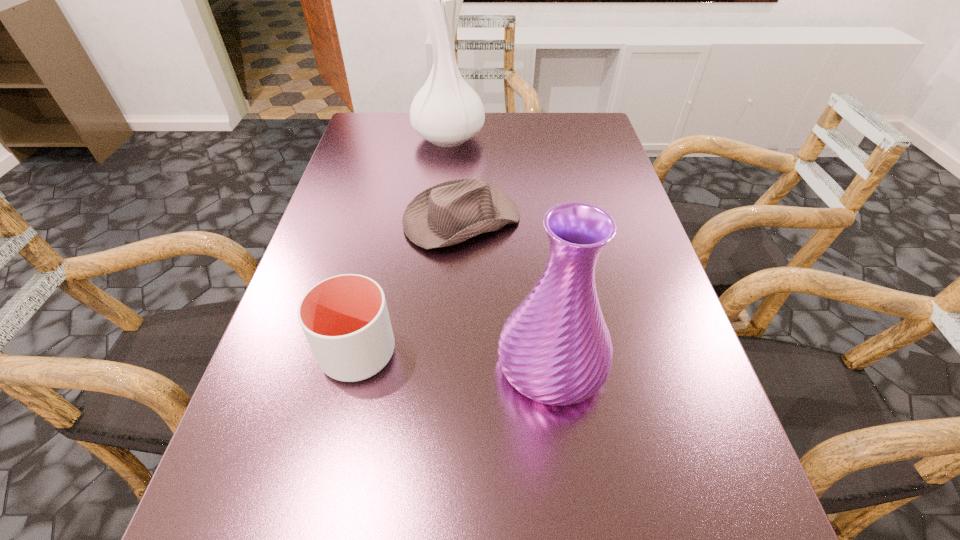
The image size is (960, 540). Identify the location of free spot between the second shortest object and the farther vase. (403, 245).

This screenshot has width=960, height=540. What are the coordinates of `unoccupied area between the third nearest object and the farthest object` in the screenshot? It's located at (455, 179).

The height and width of the screenshot is (540, 960). I want to click on free space between the farther vase and the second farthest object, so click(455, 179).

Find the location of a particular element. empty space that is in between the second shortest object and the nearer vase is located at coordinates (455, 358).

This screenshot has height=540, width=960. Identify the location of empty space between the third nearest object and the farthest object. (455, 179).

At what (x,y) coordinates should I click in order to perform the action: click on free spot between the second shortest object and the farthest object. Please return your answer as a coordinate pair (x, y). Looking at the image, I should click on (403, 245).

Identify the location of vacant region between the left vase and the cup. (403, 245).

I want to click on object that is the third closest to the nearer vase, so click(447, 112).

At what (x,y) coordinates should I click in order to perform the action: click on object that stands as the third closest to the shorter vase. Please return your answer as a coordinate pair (x, y). The image size is (960, 540). Looking at the image, I should click on (447, 112).

I want to click on free location that satisfies the following two spatial constraints: 1. on the back side of the second shortest object; 2. on the right side of the shortest object, so click(x=388, y=221).